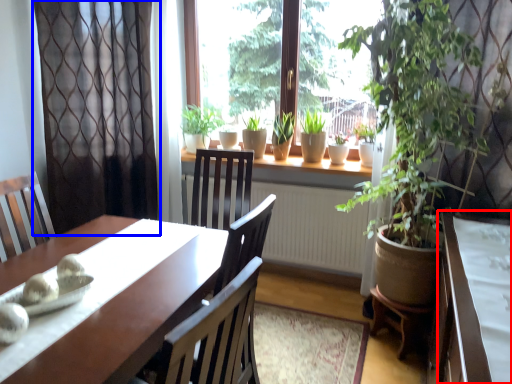
Question: Which of the following is the farthest to the observer, table (highlighted by a red box) or curtain (highlighted by a blue box)?

Choices:
 (A) table
 (B) curtain

Answer: (B)